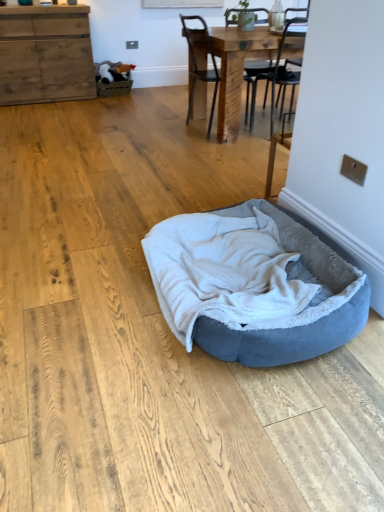
Where is `black metal chair at upper center`? The width and height of the screenshot is (384, 512). black metal chair at upper center is located at coordinates (201, 63).

Image resolution: width=384 pixels, height=512 pixels. Find the location of `wooden cabinet at upper left`. wooden cabinet at upper left is located at coordinates (45, 54).

Identify the location of soft gray plush dog bed at center. (252, 286).

Is soft gray plush dog bed at center next to wooden table at center?

No, soft gray plush dog bed at center is not next to wooden table at center.

What's the angular difference between soft gray plush dog bed at center and wooden table at center's facing directions?

They differ by 86.9 degrees in their facing directions.

From a real-world perspective, is soft gray plush dog bed at center located beneath wooden table at center?

Yes, from a real-world perspective, soft gray plush dog bed at center is under wooden table at center.

Is point (235, 349) more distant than point (206, 104)?

No, (235, 349) is in front of (206, 104).

Is the surface of wooden table at center in direct contact with soft gray plush dog bed at center?

No, wooden table at center is not in contact with soft gray plush dog bed at center.

From the image's perspective, which object appears higher, wooden table at center or soft gray plush dog bed at center?

wooden table at center is shown above in the image.

Considering the sizes of objects wooden table at center and soft gray plush dog bed at center in the image provided, who is thinner, wooden table at center or soft gray plush dog bed at center?

soft gray plush dog bed at center.

Is wooden table at center positioned in front of soft gray plush dog bed at center?

No, the depth of wooden table at center is greater than that of soft gray plush dog bed at center.

Looking at their sizes, would you say wooden cabinet at upper left is wider or thinner than soft gray plush dog bed at center?

In the image, wooden cabinet at upper left appears to be more narrow than soft gray plush dog bed at center.

From the image's perspective, is wooden cabinet at upper left located above soft gray plush dog bed at center?

Yes, from the image's perspective, wooden cabinet at upper left is above soft gray plush dog bed at center.

What's the angular difference between wooden cabinet at upper left and soft gray plush dog bed at center's facing directions?

The angle between the facing direction of wooden cabinet at upper left and the facing direction of soft gray plush dog bed at center is 177 degrees.

Does wooden cabinet at upper left touch black metal chair at upper center?

wooden cabinet at upper left is not next to black metal chair at upper center, and they're not touching.

Is point (87, 47) closer to camera compared to point (215, 87)?

No, (87, 47) is behind (215, 87).

Is wooden cabinet at upper left situated inside black metal chair at upper center or outside?

wooden cabinet at upper left is located beyond the bounds of black metal chair at upper center.

Are soft gray plush dog bed at center and black metal chair at upper center beside each other?

No, soft gray plush dog bed at center is not next to black metal chair at upper center.

Considering the positions of objects soft gray plush dog bed at center and black metal chair at upper center in the image provided, who is behind, soft gray plush dog bed at center or black metal chair at upper center?

black metal chair at upper center is behind.

Identify the location of chair behind the soft gray plush dog bed at center. (201, 63).

Is wooden cabinet at upper left not within wooden table at center?

Yes, wooden cabinet at upper left is not within wooden table at center.

How different are the orientations of wooden cabinet at upper left and wooden table at center in degrees?

90.1 degrees.

From a real-world perspective, which is physically below, wooden cabinet at upper left or wooden table at center?

wooden table at center.

Is black metal chair at upper center bigger than wooden cabinet at upper left?

No, black metal chair at upper center is not bigger than wooden cabinet at upper left.

From the image's perspective, which one is positioned lower, black metal chair at upper center or wooden cabinet at upper left?

black metal chair at upper center.

Between black metal chair at upper center and wooden cabinet at upper left, which one has smaller width?

wooden cabinet at upper left.

Is point (200, 39) in front of point (20, 27)?

That is True.

Locate an element on the screen. The image size is (384, 512). dog bed in front of the wooden table at center is located at coordinates (252, 286).

This screenshot has width=384, height=512. Find the location of `dog bed below the wooden table at center (from a real-world perspective)`. dog bed below the wooden table at center (from a real-world perspective) is located at coordinates (252, 286).

Estimate the real-world distances between objects in this image. Which object is further from soft gray plush dog bed at center, black metal chair at upper center or wooden table at center?

Among the two, black metal chair at upper center is located further to soft gray plush dog bed at center.

Based on their spatial positions, is wooden cabinet at upper left or soft gray plush dog bed at center further from black metal chair at upper center?

Based on the image, soft gray plush dog bed at center appears to be further to black metal chair at upper center.

When comparing their distances from black metal chair at upper center, does soft gray plush dog bed at center or wooden cabinet at upper left seem further?

soft gray plush dog bed at center is further to black metal chair at upper center.

Estimate the real-world distances between objects in this image. Which object is closer to black metal chair at upper center, soft gray plush dog bed at center or wooden table at center?

wooden table at center.

Which object lies nearer to the anchor point black metal chair at upper center, wooden cabinet at upper left or wooden table at center?

The object closer to black metal chair at upper center is wooden table at center.

When comparing their distances from wooden table at center, does black metal chair at upper center or wooden cabinet at upper left seem closer?

The object closer to wooden table at center is black metal chair at upper center.

Considering their positions, is soft gray plush dog bed at center positioned further to wooden cabinet at upper left than black metal chair at upper center?

The object further to wooden cabinet at upper left is soft gray plush dog bed at center.

Estimate the real-world distances between objects in this image. Which object is closer to wooden cabinet at upper left, black metal chair at upper center or soft gray plush dog bed at center?

black metal chair at upper center.

The width and height of the screenshot is (384, 512). I want to click on chair located between soft gray plush dog bed at center and wooden cabinet at upper left in the depth direction, so click(201, 63).

Locate an element on the screen. The image size is (384, 512). chair between wooden cabinet at upper left and wooden table at center from left to right is located at coordinates (201, 63).

Locate an element on the screen. This screenshot has height=512, width=384. table between soft gray plush dog bed at center and wooden cabinet at upper left in the front-back direction is located at coordinates (237, 70).

The width and height of the screenshot is (384, 512). Identify the location of table positioned between soft gray plush dog bed at center and black metal chair at upper center from near to far. (237, 70).